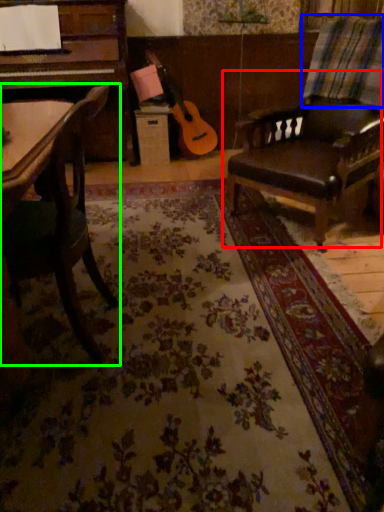
Question: Which object is the farthest from chair (highlighted by a red box)? Choose among these: plaid (highlighted by a blue box) or chair (highlighted by a green box).

Choices:
 (A) plaid
 (B) chair

Answer: (B)